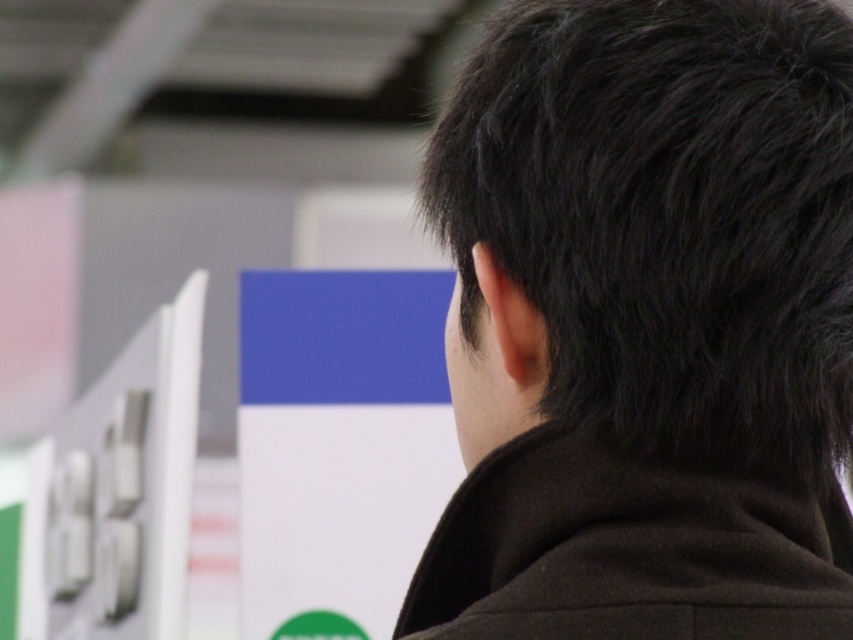
You are a photographer adjusting your camera settings to capture the scene. You need to ensure that both the black matte hair at upper right and the black matte jacket at center are in focus. Given that your camera has a depth of field that can cover objects within a 2.5 inch range, will both objects remain in focus?

The black matte hair at upper right is 2.32 inches away from the black matte jacket at center. Since the distance between them is within the camera s 2.5 inch depth of field range, both objects will remain in focus.

You are standing in the exhibition hall and see two points in the background displays. The first point is at coordinates point [602,81] and the second is at point [718,588]. If you want to touch the closest point to you, which coordinate should you aim for?

Point [602,81] is further to the viewer than point [718,588], so the closest point to you is point [718,588]. You should aim for point [718,588].

You are a photographer trying to capture the black matte hair at upper right and the black matte jacket at center in a single frame. Based on their positions, which object should you adjust your camera to focus on first to ensure both are in the frame?

The black matte hair at upper right should be focused on first since it is positioned to the left of the black matte jacket at center, allowing you to adjust the camera to include both in the frame.